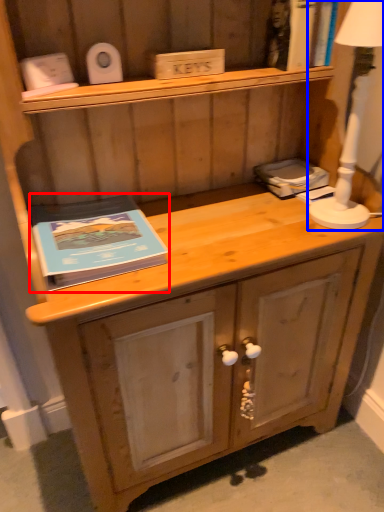
Question: Which of the following is the closest to the observer, paperback book (highlighted by a red box) or bedside lamp (highlighted by a blue box)?

Choices:
 (A) paperback book
 (B) bedside lamp

Answer: (B)